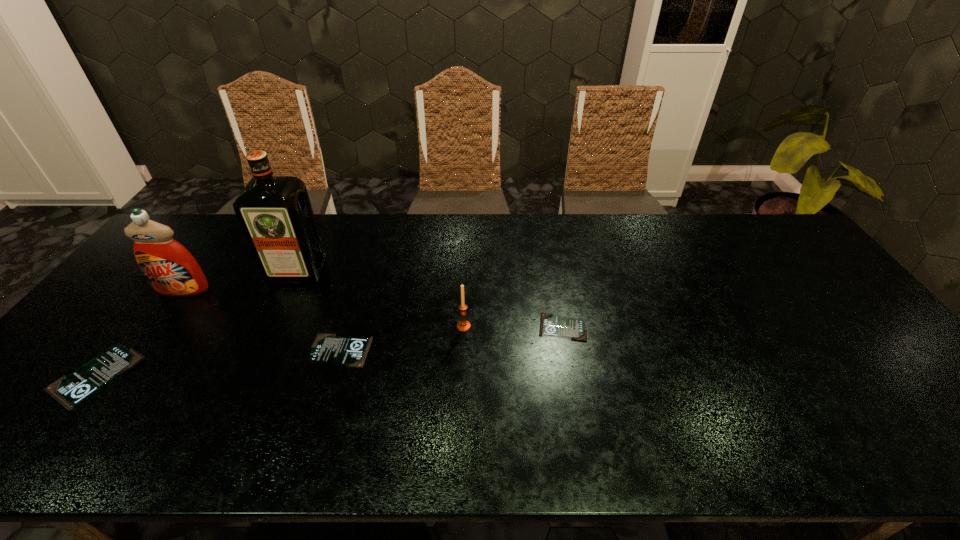
In the image, there is a desktop. Where is `free space at the far edge`? This screenshot has width=960, height=540. free space at the far edge is located at coordinates (516, 214).

Find the location of a particular element. This screenshot has height=540, width=960. free region at the left edge of the desktop is located at coordinates (136, 284).

You are a GUI agent. You are given a task and a screenshot of the screen. Output one action in this format:
    pyautogui.click(x=<x>, y=<y>)
    Task: Click on the vacant area at the right edge
    This screenshot has width=960, height=540.
    Given the screenshot: What is the action you would take?
    pos(814,270)

Locate an element on the screen. The height and width of the screenshot is (540, 960). vacant region at the far right corner is located at coordinates (767, 242).

The height and width of the screenshot is (540, 960). What are the coordinates of `vacant space that is in between the second tallest object and the leftmost identity card` in the screenshot? It's located at (139, 333).

Where is `unoccupied area between the second shortest object and the rightmost object`? This screenshot has height=540, width=960. unoccupied area between the second shortest object and the rightmost object is located at coordinates (451, 339).

The height and width of the screenshot is (540, 960). Identify the location of vacant area that lies between the second tallest object and the leftmost identity card. (139, 333).

At what (x,y) coordinates should I click in order to perform the action: click on free space between the second shortest identity card and the leftmost identity card. Please return your answer as a coordinate pair (x, y). The width and height of the screenshot is (960, 540). Looking at the image, I should click on (218, 363).

Find the location of `free space between the tallest object and the third tallest object`. free space between the tallest object and the third tallest object is located at coordinates (380, 299).

Where is `unoccupied position between the leftmost identity card and the fourth object from left to right`? This screenshot has width=960, height=540. unoccupied position between the leftmost identity card and the fourth object from left to right is located at coordinates (218, 363).